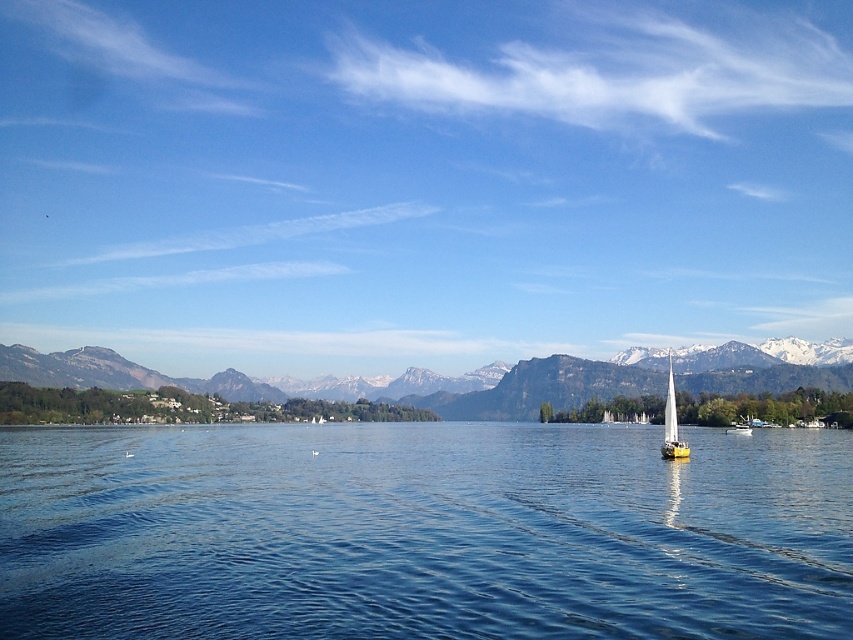
Question: Among these points, which one is farthest from the camera?

Choices:
 (A) (306, 436)
 (B) (675, 417)
 (C) (741, 432)

Answer: (A)

Question: Is yellow matte sailboat at right to the left of yellow sailboat at right from the viewer's perspective?

Choices:
 (A) no
 (B) yes

Answer: (A)

Question: Can you confirm if blue sky at upper center is smaller than green grassy mountain at center?

Choices:
 (A) yes
 (B) no

Answer: (B)

Question: Which object appears farthest from the camera in this image?

Choices:
 (A) yellow sailboat at right
 (B) blue water at center
 (C) blue sky at upper center

Answer: (C)

Question: Can you confirm if blue water at center is positioned to the right of green grassy mountain at center?

Choices:
 (A) yes
 (B) no

Answer: (B)

Question: Which is nearer to the yellow matte sailboat at right?

Choices:
 (A) blue water at center
 (B) blue sky at upper center

Answer: (A)